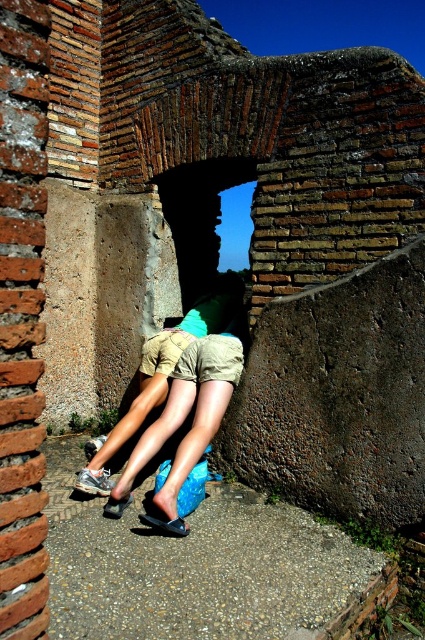
Does point (181, 352) lie in front of point (119, 509)?

No, (181, 352) is further to viewer.

Is point (224, 294) farther from camera compared to point (112, 499)?

Yes.

Measure the distance between point (x=173, y=356) and camera.

They are 4.66 meters apart.

The height and width of the screenshot is (640, 425). In order to click on khaki shorts at center in this screenshot , I will do `click(158, 376)`.

Can you confirm if khaki shorts at center is wider than black matte sandal at lower center?

Correct, the width of khaki shorts at center exceeds that of black matte sandal at lower center.

The width and height of the screenshot is (425, 640). What do you see at coordinates (158, 376) in the screenshot?
I see `khaki shorts at center` at bounding box center [158, 376].

Which is in front, point (223, 289) or point (178, 522)?

Point (178, 522) is more forward.

Find the location of `khaki shorts at center`. khaki shorts at center is located at coordinates (158, 376).

Does black matte sandal at lower center have a larger size compared to black leather sandal at lower center?

Indeed, black matte sandal at lower center has a larger size compared to black leather sandal at lower center.

Who is more distant from viewer, (149, 516) or (107, 502)?

The point (107, 502) is more distant.

Is point (170, 531) farther from camera compared to point (110, 500)?

No, (170, 531) is closer to viewer.

I want to click on black matte sandal at lower center, so click(166, 524).